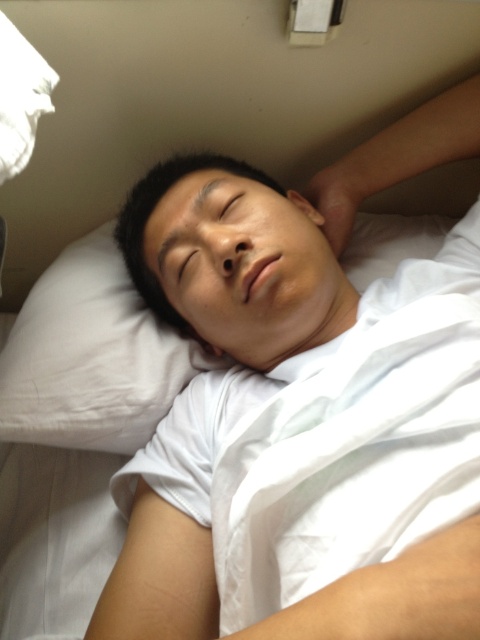
You are a photographer trying to capture a closeup of the white cotton shirt at center. The camera you are using has a minimum focusing distance of 16 inches. Can you take the photo without moving the shirt?

The white cotton shirt at center is 17.13 inches from camera. Since the minimum focusing distance is 16 inches, the camera can focus on the shirt at 17.13 inches, so yes, you can take the photo without moving the shirt.

You are a photographer taking a picture of the bed and want to ensure both point (347, 307) and point (268, 312) are in focus. Which point should you focus on first to ensure the closest object is sharp?

You should focus on point (268, 312) first because it is closer to the viewer than point (347, 307), ensuring the closest object is sharp.

You are a photographer trying to capture a closeup of the white cotton shirt at center without the white soft pillow at upper left appearing in the frame. Is this possible based on their positions?

The white cotton shirt at center is in front of the white soft pillow at upper left, so it is possible to focus on the white cotton shirt at center while excluding the white soft pillow at upper left from the frame by adjusting the camera angle or zoom.